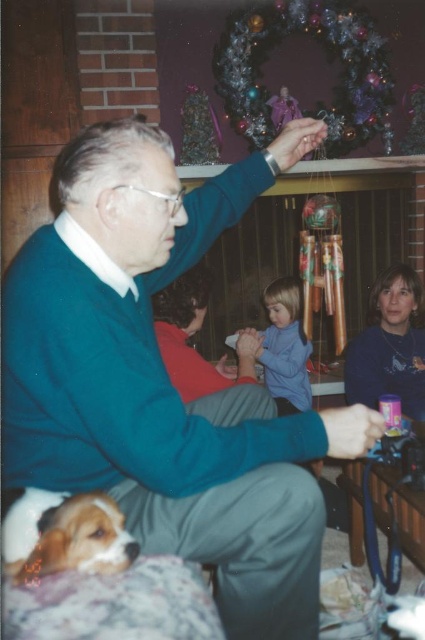
Looking at this image, does brown fur dog at lower left come in front of blue smooth shirt at center?

Yes, it is.

Can you confirm if brown fur dog at lower left is positioned above blue smooth shirt at center?

Actually, brown fur dog at lower left is below blue smooth shirt at center.

The image size is (425, 640). Describe the element at coordinates (78, 540) in the screenshot. I see `brown fur dog at lower left` at that location.

You are a GUI agent. You are given a task and a screenshot of the screen. Output one action in this format:
    pyautogui.click(x=<x>, y=<y>)
    Task: Click on the brown fur dog at lower left
    The width and height of the screenshot is (425, 640).
    Given the screenshot: What is the action you would take?
    point(78,540)

Is green sweater at center further to the viewer compared to brown fur dog at lower left?

No, green sweater at center is in front of brown fur dog at lower left.

Can you confirm if green sweater at center is positioned to the right of brown fur dog at lower left?

Yes, green sweater at center is to the right of brown fur dog at lower left.

Who is more distant from viewer, (319, 529) or (73, 556)?

The point (319, 529) is more distant.

The height and width of the screenshot is (640, 425). Find the location of `green sweater at center`. green sweater at center is located at coordinates (159, 381).

Between green sweater at center and blue smooth shirt at center, which one has more height?

green sweater at center is taller.

Does point (95, 195) come in front of point (274, 292)?

Yes.

At what (x,y) coordinates should I click in order to perform the action: click on green sweater at center. Please return your answer as a coordinate pair (x, y). Image resolution: width=425 pixels, height=640 pixels. Looking at the image, I should click on (159, 381).